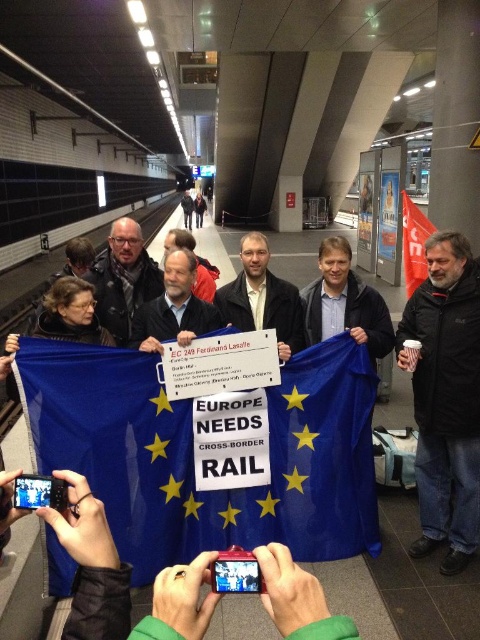
You are a photographer trying to capture a photo of the matte black sign at center without including the black jacket at right in the frame. Given their sizes, is this possible?

The black jacket at right is narrower than the matte black sign at center, so it is possible to frame the matte black sign at center without including the black jacket at right if positioned correctly.